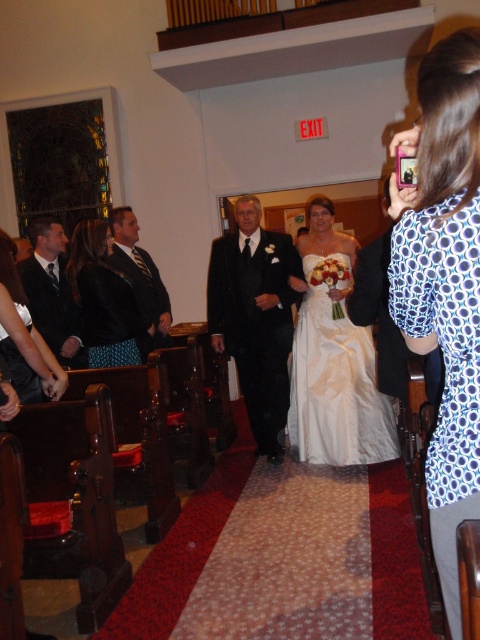
Question: Is shiny black suit at center closer to camera compared to shiny black suit at left?

Choices:
 (A) yes
 (B) no

Answer: (B)

Question: Which point appears closest to the camera in this image?

Choices:
 (A) (31, 333)
 (B) (165, 304)
 (C) (252, 401)

Answer: (A)

Question: Can you confirm if white satin dress at center is positioned to the right of matte black dress at lower left?

Choices:
 (A) no
 (B) yes

Answer: (B)

Question: Which point is closer to the camera?

Choices:
 (A) shiny black suit at center
 (B) matte black dress at lower left
 (C) white satin dress at center
 (D) shiny black suit at left

Answer: (B)

Question: Is black textured suit at center wider than matte black dress at lower left?

Choices:
 (A) no
 (B) yes

Answer: (B)

Question: Based on their relative distances, which object is farther from the matte black dress at lower left?

Choices:
 (A) shiny black suit at center
 (B) blue dotted blouse at right
 (C) black leather jacket at center

Answer: (B)